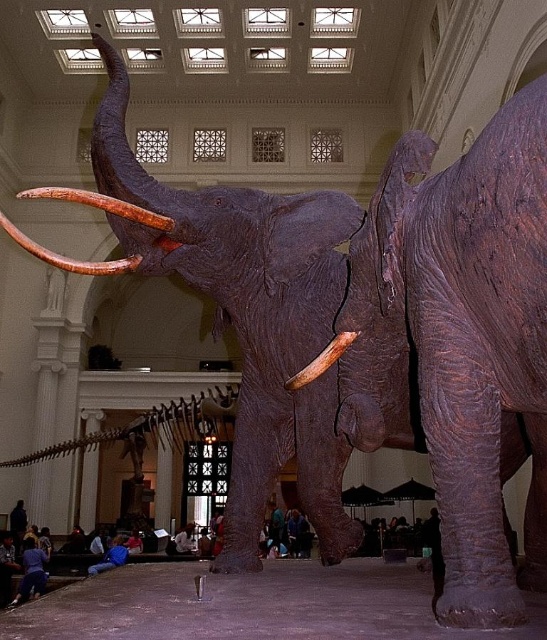
Question: Can you confirm if rough brown elephant at right is positioned above brown wood tusk at center?

Choices:
 (A) no
 (B) yes

Answer: (A)

Question: Which of the following is the farthest from the observer?

Choices:
 (A) [x=109, y=566]
 (B) [x=37, y=577]
 (C) [x=458, y=531]
 (D) [x=13, y=508]

Answer: (D)

Question: Can you confirm if brown polished tusk at left is positioned below brown wood tusk at center?

Choices:
 (A) no
 (B) yes

Answer: (A)

Question: Considering the relative positions of blue jeans at lower left and blue jeans at center in the image provided, where is blue jeans at lower left located with respect to blue jeans at center?

Choices:
 (A) right
 (B) left

Answer: (B)

Question: Which object is the farthest from the blue fabric shirt at lower left?

Choices:
 (A) brown polished tusk at left
 (B) blue jeans at center

Answer: (A)

Question: Which of the following is the farthest from the observer?

Choices:
 (A) (39, 557)
 (B) (473, 314)

Answer: (A)